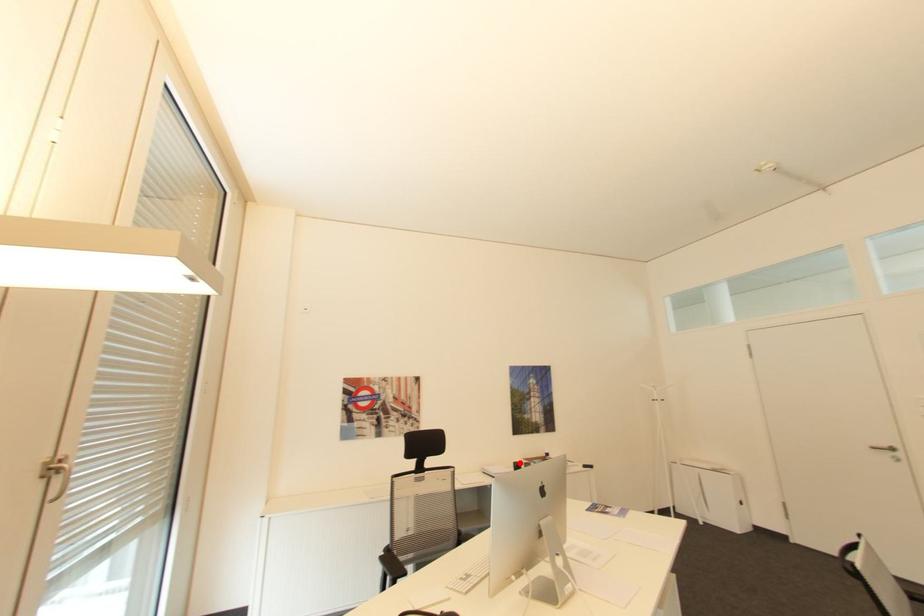
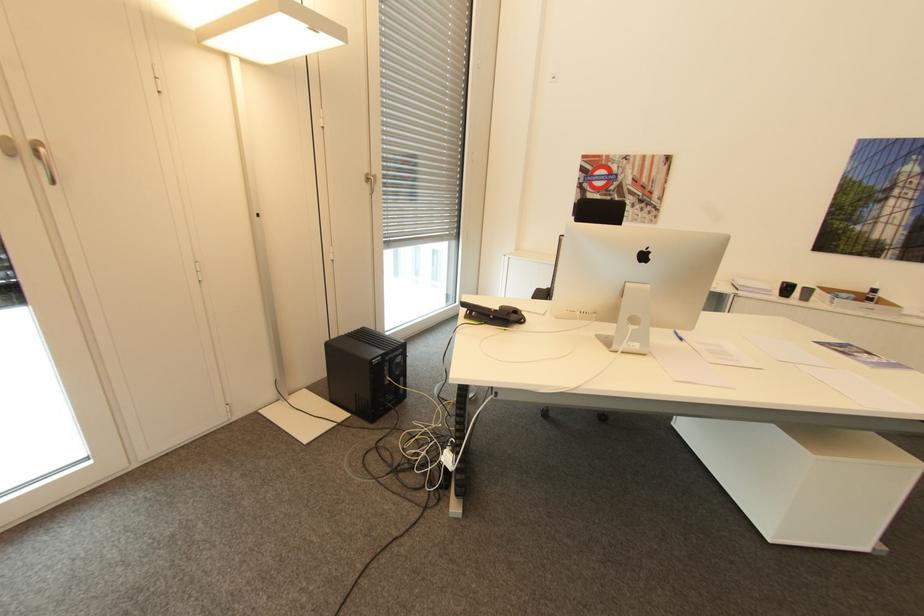
Question: A red point is marked in image1. In image2, is the corresponding 3D point closer to the camera or farther? Reply with the corresponding letter.

Choices:
 (A) The corresponding 3D point is closer.
 (B) The corresponding 3D point is farther.

Answer: (A)